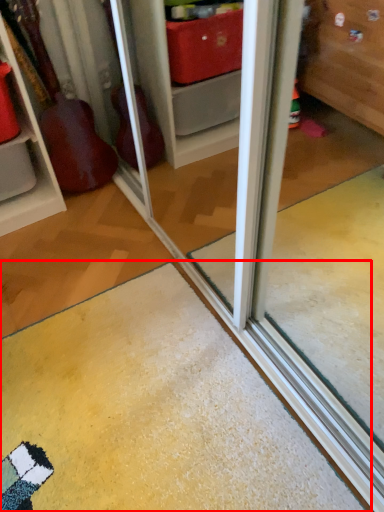
Question: From the image's perspective, considering the relative positions of doormat (annotated by the red box) and shelf in the image provided, where is doormat (annotated by the red box) located with respect to the staircase?

Choices:
 (A) below
 (B) above

Answer: (A)